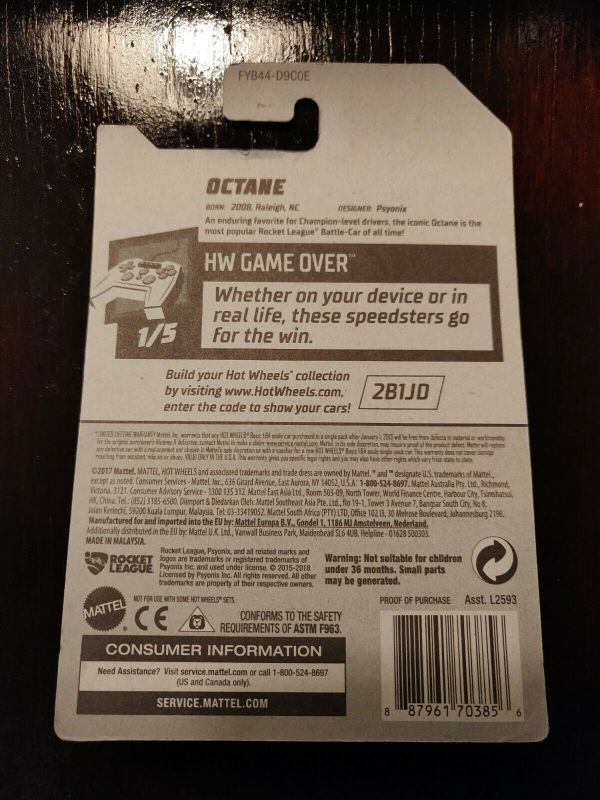
At what (x,y) coordinates should I click in order to perform the action: click on game controller. Please return your answer as a coordinate pair (x, y). The width and height of the screenshot is (600, 800). Looking at the image, I should click on (152, 292).